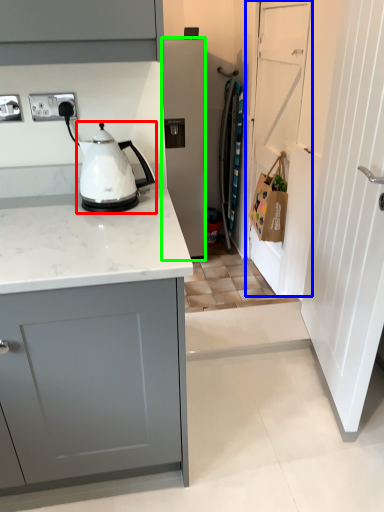
Question: Which object is the closest to the kitchen appliance (highlighted by a red box)? Choose among these: door (highlighted by a blue box) or home appliance (highlighted by a green box).

Choices:
 (A) door
 (B) home appliance

Answer: (A)